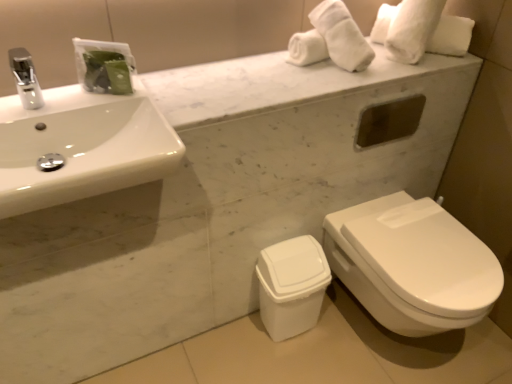
Question: Is point (22, 100) closer or farther from the camera than point (57, 109)?

Choices:
 (A) closer
 (B) farther

Answer: (B)

Question: Is silver metallic faucet at upper left spatially inside white glossy sink at upper left, or outside of it?

Choices:
 (A) inside
 (B) outside

Answer: (B)

Question: Which is nearer to the silver metallic faucet at upper left?

Choices:
 (A) white plastic trash can at lower center
 (B) white glossy sink at upper left
 (C) white glossy toilet at lower right

Answer: (B)

Question: Which object is positioned farthest from the white plastic trash can at lower center?

Choices:
 (A) white glossy sink at upper left
 (B) silver metallic faucet at upper left
 (C) white glossy toilet at lower right

Answer: (B)